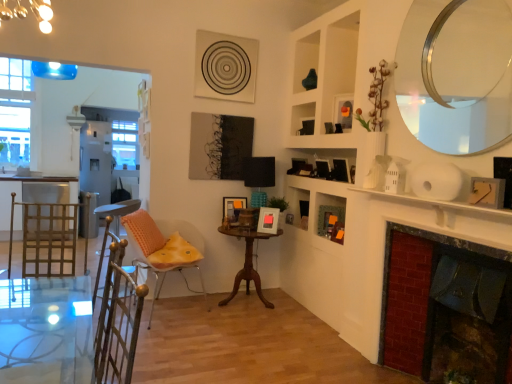
What do you see at coordinates (268, 220) in the screenshot? This screenshot has width=512, height=384. I see `matte pink picture frame at center, arranged as the third picture frame when viewed from the front` at bounding box center [268, 220].

Describe the element at coordinates (15, 112) in the screenshot. I see `clear glass window at upper left` at that location.

Locate an element on the screen. Image resolution: width=512 pixels, height=384 pixels. orange matte picture frame at upper center, which is the 2th picture frame in front-to-back order is located at coordinates (344, 111).

You are a GUI agent. You are given a task and a screenshot of the screen. Output one action in this format:
    pyautogui.click(x=<x>, y=<y>)
    Task: Click on the transparent glass table at lower left
    Image resolution: width=512 pixels, height=384 pixels.
    Given the screenshot: What is the action you would take?
    pyautogui.click(x=46, y=330)

At what (x,y) coordinates should I click in order to perform the action: click on white glossy screen door at left. Please return your answer as a coordinate pair (x, y). This screenshot has height=384, width=512. Looking at the image, I should click on (96, 166).

Considering the relative positions of wooden picture frame at upper right, marked as the 2th picture frame in a top-to-bottom arrangement, and silver metallic mirror at upper right in the image provided, is wooden picture frame at upper right, marked as the 2th picture frame in a top-to-bottom arrangement, in front of silver metallic mirror at upper right?

No, it is behind silver metallic mirror at upper right.

How different are the orientations of wooden picture frame at upper right, placed as the fourth picture frame when sorted from left to right, and silver metallic mirror at upper right in degrees?

There is a 5.72-degree angle between the facing directions of wooden picture frame at upper right, placed as the fourth picture frame when sorted from left to right, and silver metallic mirror at upper right.

Is wooden picture frame at upper right, arranged as the 1th picture frame when viewed from the front, to the left or to the right of silver metallic mirror at upper right in the image?

Based on their positions, wooden picture frame at upper right, arranged as the 1th picture frame when viewed from the front, is located to the right of silver metallic mirror at upper right.

Choose the correct answer: Is wooden picture frame at center, which is the fourth picture frame in right-to-left order, inside mahogany wood table at center or outside it?

wooden picture frame at center, which is the fourth picture frame in right-to-left order, lies outside mahogany wood table at center.

Is wooden picture frame at center, arranged as the 4th picture frame when viewed from the front, bigger than mahogany wood table at center?

No, wooden picture frame at center, arranged as the 4th picture frame when viewed from the front, is not bigger than mahogany wood table at center.

I want to click on the 3rd picture frame below when counting from the orange matte picture frame at upper center, the 1th picture frame positioned from the top (from the image's perspective), so click(268, 220).

Who is smaller, matte pink picture frame at center, which is the 4th picture frame in top-to-bottom order, or orange matte picture frame at upper center, acting as the fourth picture frame starting from the bottom?

Smaller between the two is orange matte picture frame at upper center, acting as the fourth picture frame starting from the bottom.

How different are the orientations of matte pink picture frame at center, the second picture frame from the left, and orange matte picture frame at upper center, which is the 2th picture frame in front-to-back order, in degrees?

27.2 degrees separate the facing orientations of matte pink picture frame at center, the second picture frame from the left, and orange matte picture frame at upper center, which is the 2th picture frame in front-to-back order.

Which is farther, (231, 205) or (37, 289)?

Positioned behind is point (231, 205).

Locate an element on the screen. The width and height of the screenshot is (512, 384). picture frame that is the 1st one below the transparent glass table at lower left (from a real-world perspective) is located at coordinates (233, 207).

Is wooden picture frame at center, arranged as the 1th picture frame when viewed from the back, not inside transparent glass table at lower left?

wooden picture frame at center, arranged as the 1th picture frame when viewed from the back, is positioned outside transparent glass table at lower left.

Would you say brick fireplace at right is inside or outside silver metallic mirror at upper right?

brick fireplace at right is located beyond the bounds of silver metallic mirror at upper right.

Is point (383, 334) closer to camera compared to point (487, 72)?

No, (383, 334) is behind (487, 72).

Considering the sizes of objects brick fireplace at right and silver metallic mirror at upper right in the image provided, who is wider, brick fireplace at right or silver metallic mirror at upper right?

brick fireplace at right.

From a real-world perspective, is brick fireplace at right over silver metallic mirror at upper right?

No, from a real-world perspective, brick fireplace at right is not on top of silver metallic mirror at upper right.

In the scene shown: Would you consider orange fabric chair at center to be distant from white glossy screen door at left?

Yes, orange fabric chair at center is far from white glossy screen door at left.

Who is taller, orange fabric chair at center or white glossy screen door at left?

Standing taller between the two is white glossy screen door at left.

Is orange fabric chair at center bigger than white glossy screen door at left?

Incorrect, orange fabric chair at center is not larger than white glossy screen door at left.

Between orange fabric chair at center and white glossy screen door at left, which one appears on the right side from the viewer's perspective?

orange fabric chair at center.

Is wooden picture frame at center, arranged as the 4th picture frame when viewed from the front, inside the boundaries of white glossy screen door at left, or outside?

The correct answer is: outside.

Considering the positions of objects wooden picture frame at center, which is the fourth picture frame in right-to-left order, and white glossy screen door at left in the image provided, who is in front, wooden picture frame at center, which is the fourth picture frame in right-to-left order, or white glossy screen door at left?

Positioned in front is wooden picture frame at center, which is the fourth picture frame in right-to-left order.

Locate an element on the screen. mirror that is above the wooden picture frame at upper right, the fourth picture frame positioned from the back (from a real-world perspective) is located at coordinates (457, 74).

I want to click on the 2nd picture frame above when counting from the mahogany wood table at center (from the image's perspective), so click(233, 207).

Estimate the real-world distances between objects in this image. Which object is closer to transparent glass table at lower left, white glossy screen door at left or wooden picture frame at center, arranged as the 1th picture frame when viewed from the back?

wooden picture frame at center, arranged as the 1th picture frame when viewed from the back, is closer to transparent glass table at lower left.

Which object lies nearer to the anchor point matte pink picture frame at center, the second picture frame from the back, brick fireplace at right or wooden picture frame at upper right, the fourth picture frame positioned from the back?

The object closer to matte pink picture frame at center, the second picture frame from the back, is brick fireplace at right.

Which object lies further to the anchor point silver metallic mirror at upper right, transparent glass table at lower left or white glossy screen door at left?

The object further to silver metallic mirror at upper right is white glossy screen door at left.

Estimate the real-world distances between objects in this image. Which object is closer to brick fireplace at right, wooden picture frame at center, arranged as the 1th picture frame when viewed from the back, or matte pink picture frame at center, positioned as the third picture frame in right-to-left order?

matte pink picture frame at center, positioned as the third picture frame in right-to-left order, is positioned closer to the anchor brick fireplace at right.

From the image, which object appears to be nearer to silver metallic mirror at upper right, mahogany wood table at center or orange fabric chair at center?

mahogany wood table at center is closer to silver metallic mirror at upper right.

From the image, which object appears to be farther from white glossy screen door at left, wooden picture frame at upper right, the fourth picture frame positioned from the back, or wooden picture frame at center, which is counted as the first picture frame, starting from the left?

wooden picture frame at upper right, the fourth picture frame positioned from the back, is positioned further to the anchor white glossy screen door at left.

From the image, which object appears to be nearer to orange matte picture frame at upper center, which ranks as the 3th picture frame in back-to-front order, white glossy screen door at left or orange fabric chair at center?

orange fabric chair at center is closer to orange matte picture frame at upper center, which ranks as the 3th picture frame in back-to-front order.

Looking at the image, which one is located further to white glossy screen door at left, transparent glass table at lower left or mahogany wood table at center?

Based on the image, transparent glass table at lower left appears to be further to white glossy screen door at left.

Identify the location of window between wooden picture frame at center, which is the fourth picture frame in right-to-left order, and white glossy screen door at left, along the z-axis. (15, 112).

You are a GUI agent. You are given a task and a screenshot of the screen. Output one action in this format:
    pyautogui.click(x=<x>, y=<y>)
    Task: Click on the table between orange fabric chair at center and white glossy screen door at left in the front-back direction
    This screenshot has width=512, height=384.
    Given the screenshot: What is the action you would take?
    pos(247,262)

This screenshot has height=384, width=512. I want to click on fireplace between transparent glass table at lower left and orange matte picture frame at upper center, acting as the fourth picture frame starting from the bottom, along the z-axis, so click(x=429, y=240).

The height and width of the screenshot is (384, 512). I want to click on table positioned between transparent glass table at lower left and clear glass window at upper left from near to far, so click(247, 262).